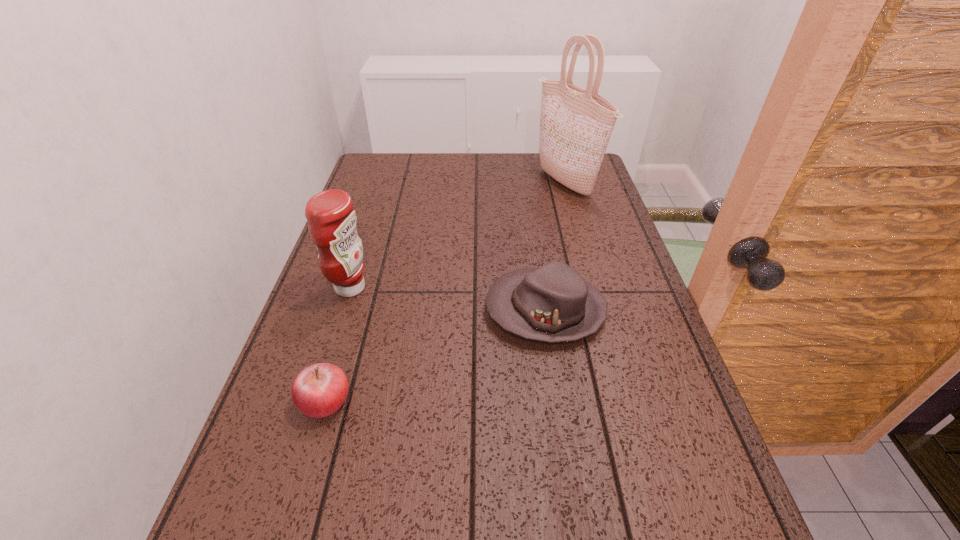
Find the location of `free space located 0.240m on the right of the nearest object`. free space located 0.240m on the right of the nearest object is located at coordinates (473, 401).

Image resolution: width=960 pixels, height=540 pixels. Find the location of `object at the far edge`. object at the far edge is located at coordinates tap(576, 124).

This screenshot has height=540, width=960. I want to click on condiment that is at the left edge, so click(x=331, y=217).

The image size is (960, 540). What are the coordinates of `apple that is at the left edge` in the screenshot? It's located at pyautogui.click(x=319, y=390).

This screenshot has width=960, height=540. In order to click on shopping bag that is positioned at the right edge in this screenshot , I will do `click(576, 124)`.

Locate an element on the screen. hat that is at the right edge is located at coordinates (553, 303).

The image size is (960, 540). I want to click on object that is at the far right corner, so click(576, 124).

This screenshot has height=540, width=960. What are the coordinates of `free spot at the far edge of the desktop` in the screenshot? It's located at (502, 159).

In order to click on vacant space at the left edge of the desktop in this screenshot , I will do `click(374, 228)`.

Where is `free space at the far left corner of the desktop`? This screenshot has height=540, width=960. free space at the far left corner of the desktop is located at coordinates (404, 181).